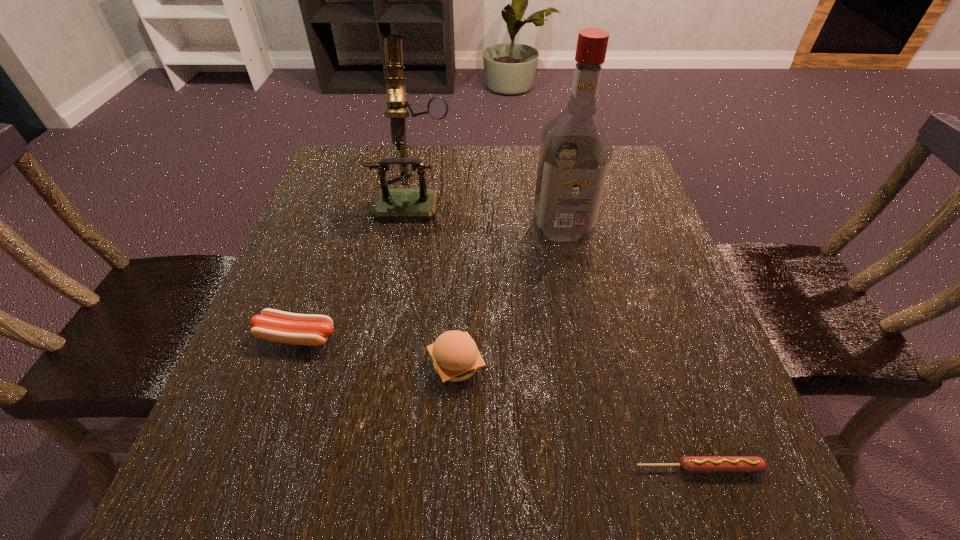
The width and height of the screenshot is (960, 540). Find the location of `free region at the far edge of the desktop`. free region at the far edge of the desktop is located at coordinates (430, 169).

Locate an element on the screen. This screenshot has height=540, width=960. vacant region at the near edge is located at coordinates (380, 475).

Find the location of a particular element. vacant space at the left edge of the desktop is located at coordinates (360, 269).

The height and width of the screenshot is (540, 960). In the image, there is a desktop. Find the location of `vacant space at the right edge`. vacant space at the right edge is located at coordinates (634, 215).

Image resolution: width=960 pixels, height=540 pixels. In the image, there is a desktop. Find the location of `blank space at the far left corner`. blank space at the far left corner is located at coordinates (366, 176).

At what (x,y) coordinates should I click in order to perform the action: click on vacant space at the near left corner of the desktop. Please return your answer as a coordinate pair (x, y). Looking at the image, I should click on [x=229, y=492].

Identify the location of vacant area at the near right corner. click(675, 453).

The width and height of the screenshot is (960, 540). What are the coordinates of `free spot between the second tallest object and the shorter sausage` in the screenshot? It's located at (557, 333).

Identify the location of free space between the second shortest object and the liquor. The height and width of the screenshot is (540, 960). (429, 283).

This screenshot has width=960, height=540. I want to click on vacant point located between the liquor and the shortest object, so click(630, 348).